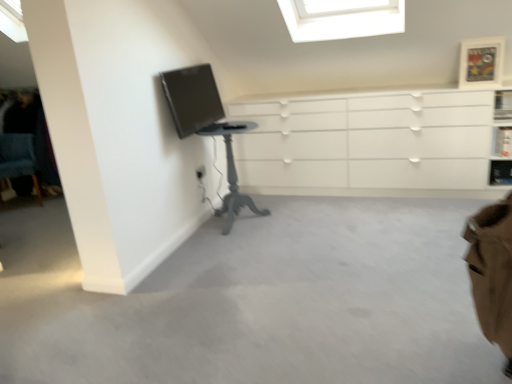
Question: Considering the relative positions of brown fabric swivel chair at lower right and blue fabric chair at lower left in the image provided, is brown fabric swivel chair at lower right to the right of blue fabric chair at lower left from the viewer's perspective?

Choices:
 (A) yes
 (B) no

Answer: (A)

Question: Does brown fabric swivel chair at lower right have a lesser width compared to blue fabric chair at lower left?

Choices:
 (A) no
 (B) yes

Answer: (B)

Question: From a real-world perspective, is brown fabric swivel chair at lower right on top of blue fabric chair at lower left?

Choices:
 (A) no
 (B) yes

Answer: (B)

Question: From the image's perspective, is brown fabric swivel chair at lower right located above blue fabric chair at lower left?

Choices:
 (A) yes
 (B) no

Answer: (B)

Question: Could blue fabric chair at lower left be considered to be inside brown fabric swivel chair at lower right?

Choices:
 (A) yes
 (B) no

Answer: (B)

Question: Choose the correct answer: Is transparent glass skylight at upper center inside metallic silver shelf at upper right, which is counted as the 2th shelf, starting from the top, or outside it?

Choices:
 (A) outside
 (B) inside

Answer: (A)

Question: From a real-world perspective, is transparent glass skylight at upper center positioned above or below metallic silver shelf at upper right, which is counted as the 2th shelf, starting from the top?

Choices:
 (A) below
 (B) above

Answer: (B)

Question: Considering the positions of transparent glass skylight at upper center and metallic silver shelf at upper right, arranged as the first shelf when ordered from the bottom, in the image, is transparent glass skylight at upper center taller or shorter than metallic silver shelf at upper right, arranged as the first shelf when ordered from the bottom,?

Choices:
 (A) tall
 (B) short

Answer: (A)

Question: Is transparent glass skylight at upper center in front of or behind metallic silver shelf at upper right, arranged as the first shelf when ordered from the bottom, in the image?

Choices:
 (A) front
 (B) behind

Answer: (A)

Question: Is wooden picture frame at upper right inside the boundaries of transparent glass skylight at upper center, or outside?

Choices:
 (A) inside
 (B) outside

Answer: (B)

Question: In terms of width, does wooden picture frame at upper right look wider or thinner when compared to transparent glass skylight at upper center?

Choices:
 (A) thin
 (B) wide

Answer: (A)

Question: In terms of height, does wooden picture frame at upper right look taller or shorter compared to transparent glass skylight at upper center?

Choices:
 (A) tall
 (B) short

Answer: (B)

Question: Does point (483, 84) appear closer or farther from the camera than point (358, 26)?

Choices:
 (A) closer
 (B) farther

Answer: (B)

Question: Is blue fabric chair at lower left taller or shorter than metallic silver shelf at upper right, which is counted as the 2th shelf, starting from the top?

Choices:
 (A) short
 (B) tall

Answer: (B)

Question: Looking at their shapes, would you say blue fabric chair at lower left is wider or thinner than metallic silver shelf at upper right, which is counted as the 2th shelf, starting from the top?

Choices:
 (A) thin
 (B) wide

Answer: (B)